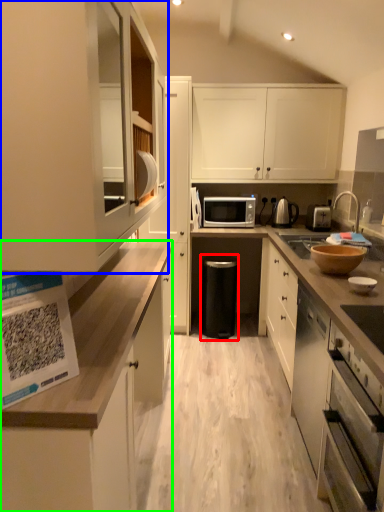
Question: Considering the real-world distances, which object is farthest from dish washer (highlighted by a red box)? cabinetry (highlighted by a blue box) or cabinetry (highlighted by a green box)?

Choices:
 (A) cabinetry
 (B) cabinetry

Answer: (A)